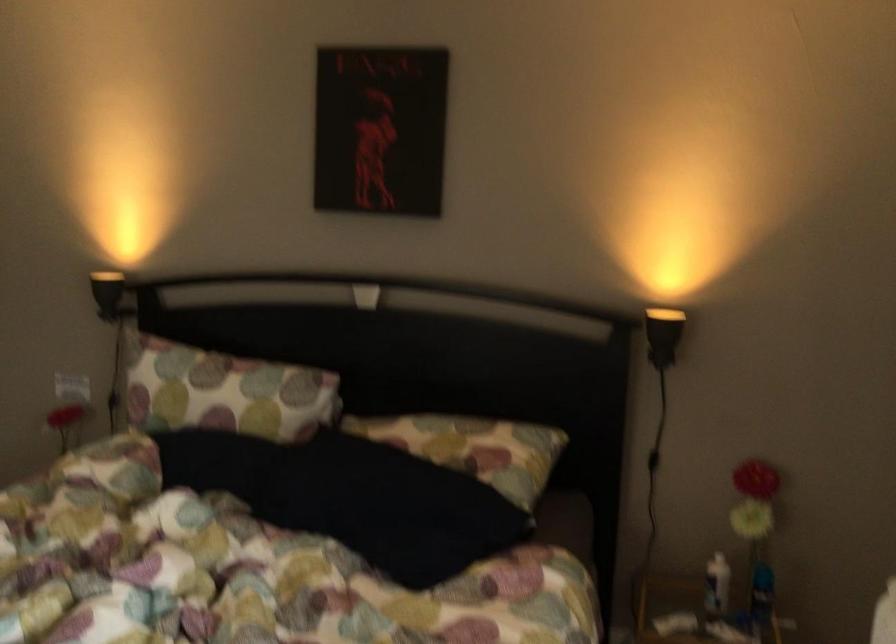
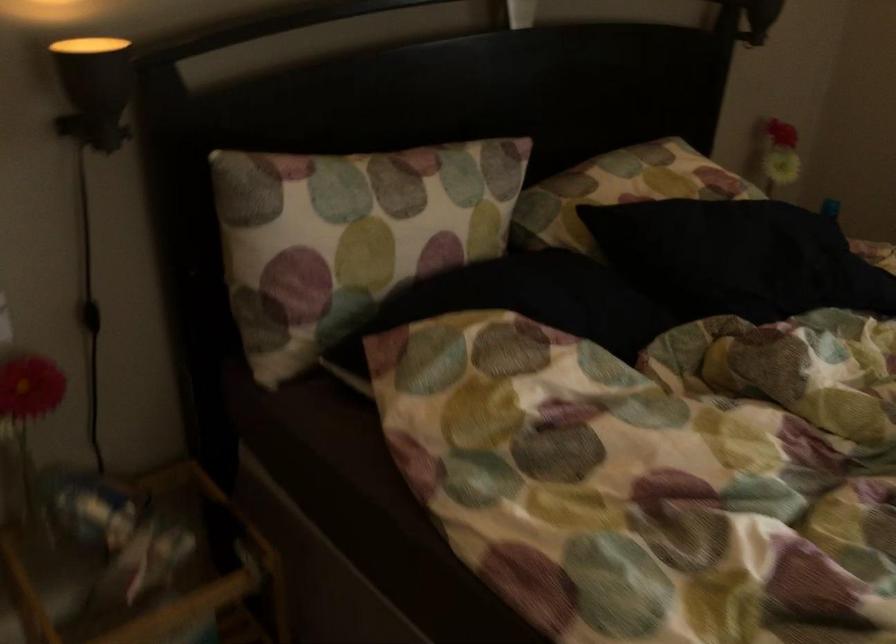
Question: I am providing you with two images of the same scene from different viewpoints. After the viewpoint changes to image2, which objects are now occluded?

Choices:
 (A) patterned white pillow
 (B) black cord switch
 (C) black lamp head
 (D) none of these

Answer: (D)